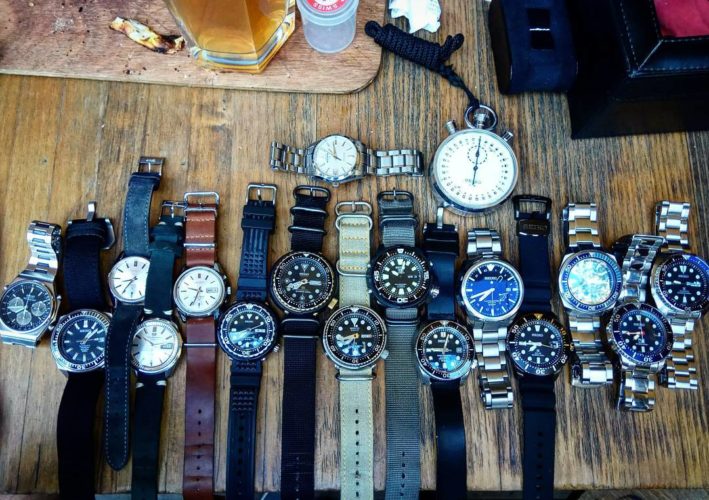
Where is `wood surface`? Image resolution: width=709 pixels, height=500 pixels. wood surface is located at coordinates (40, 181), (59, 31).